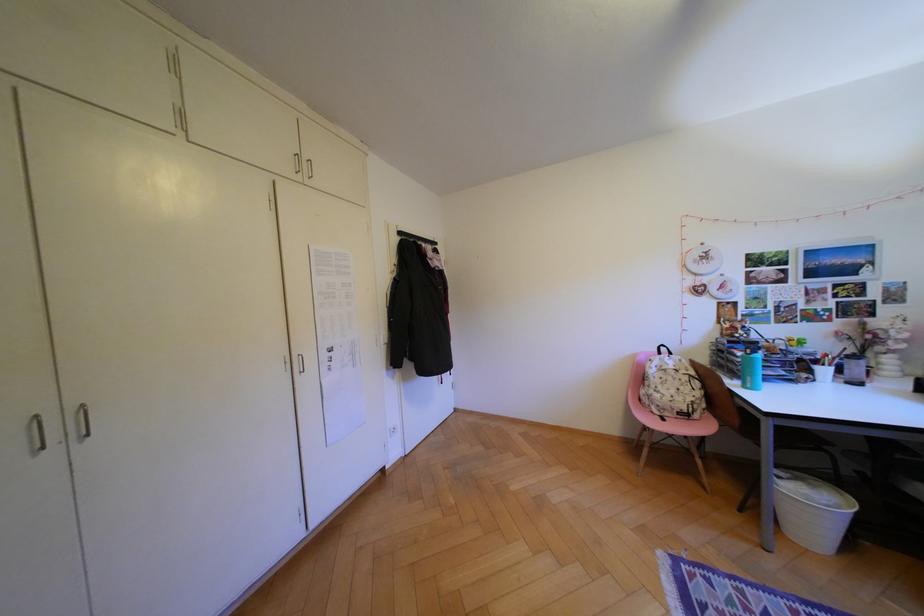
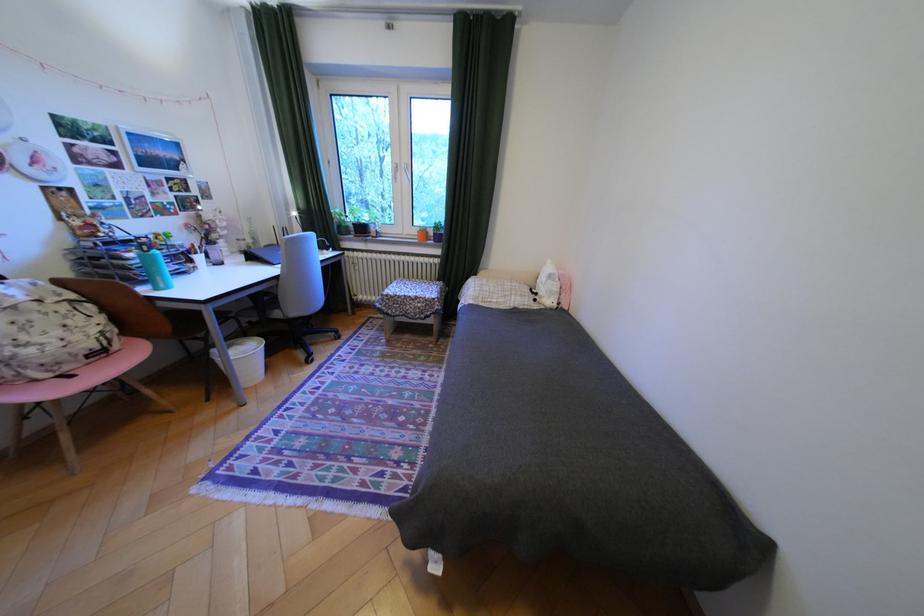
The point at (678, 414) is marked in the first image. Where is the corresponding point in the second image?

(79, 368)